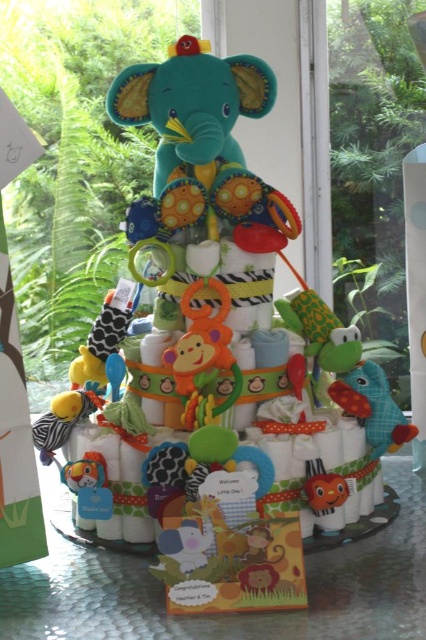
Question: Is yellow plush monkey at center positioned at the back of soft plush tiger at lower left?

Choices:
 (A) no
 (B) yes

Answer: (A)

Question: In this image, where is soft plush fish at center located relative to soft plush tiger at lower left?

Choices:
 (A) below
 (B) above

Answer: (B)

Question: Which point is farther to the camera?

Choices:
 (A) soft plush tiger at lower left
 (B) soft plush fish at center
 (C) matte orange plush toy at center

Answer: (B)

Question: Is soft plush fish at center smaller than soft plush tiger at lower left?

Choices:
 (A) yes
 (B) no

Answer: (B)

Question: Which of the following is the closest to the observer?

Choices:
 (A) (71, 406)
 (B) (342, 488)

Answer: (B)

Question: Which object is the farthest from the matte orange plush toy at center?

Choices:
 (A) soft plush tiger at lower left
 (B) soft plush fish at center
 (C) yellow plush monkey at center

Answer: (C)